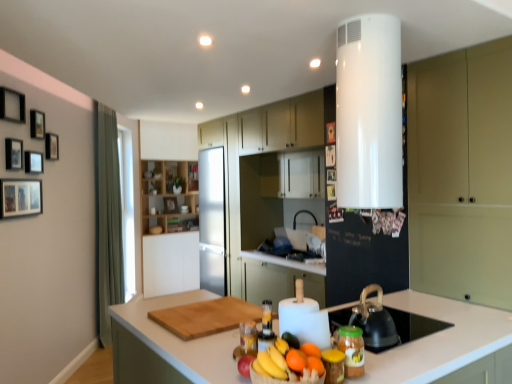
Question: Would you consider black matte tea pot at lower right to be distant from wooden picture frame at upper left, which is counted as the 7th picture frame, starting from the back?

Choices:
 (A) no
 (B) yes

Answer: (B)

Question: Can you confirm if black matte tea pot at lower right is positioned to the right of wooden picture frame at upper left, the 2th picture frame viewed from the left?

Choices:
 (A) yes
 (B) no

Answer: (A)

Question: Is black matte tea pot at lower right turned away from wooden picture frame at upper left, the tenth picture frame in the right-to-left sequence?

Choices:
 (A) no
 (B) yes

Answer: (A)

Question: Considering the relative sizes of black matte tea pot at lower right and wooden picture frame at upper left, the 2th picture frame viewed from the left, in the image provided, is black matte tea pot at lower right thinner than wooden picture frame at upper left, the 2th picture frame viewed from the left,?

Choices:
 (A) no
 (B) yes

Answer: (A)

Question: Is black matte tea pot at lower right in contact with wooden picture frame at upper left, the 2th picture frame viewed from the left?

Choices:
 (A) no
 (B) yes

Answer: (A)

Question: Considering the relative positions of black matte tea pot at lower right and wooden picture frame at upper left, which is the fifth picture frame in front-to-back order, in the image provided, is black matte tea pot at lower right to the left of wooden picture frame at upper left, which is the fifth picture frame in front-to-back order, from the viewer's perspective?

Choices:
 (A) yes
 (B) no

Answer: (B)

Question: Are wooden picture frame at upper center, which ranks as the 9th picture frame in left-to-right order, and black matte tea pot at lower right far apart?

Choices:
 (A) no
 (B) yes

Answer: (B)

Question: Considering the relative sizes of wooden picture frame at upper center, placed as the 3th picture frame when sorted from right to left, and black matte tea pot at lower right in the image provided, is wooden picture frame at upper center, placed as the 3th picture frame when sorted from right to left, wider than black matte tea pot at lower right?

Choices:
 (A) no
 (B) yes

Answer: (A)

Question: Is the depth of wooden picture frame at upper center, placed as the 3th picture frame when sorted from right to left, less than that of black matte tea pot at lower right?

Choices:
 (A) no
 (B) yes

Answer: (A)

Question: Is wooden picture frame at upper center, which is counted as the sixth picture frame, starting from the front, not within black matte tea pot at lower right?

Choices:
 (A) no
 (B) yes

Answer: (B)

Question: Could you tell me if wooden picture frame at upper center, placed as the 3th picture frame when sorted from right to left, is facing black matte tea pot at lower right?

Choices:
 (A) no
 (B) yes

Answer: (A)

Question: Considering the relative sizes of wooden picture frame at upper center, which is counted as the sixth picture frame, starting from the front, and black matte tea pot at lower right in the image provided, is wooden picture frame at upper center, which is counted as the sixth picture frame, starting from the front, bigger than black matte tea pot at lower right?

Choices:
 (A) no
 (B) yes

Answer: (A)

Question: Considering the relative sizes of wooden picture frame at upper center, marked as the fifth picture frame in a back-to-front arrangement, and wooden picture frame at upper center, arranged as the tenth picture frame when viewed from the left, in the image provided, is wooden picture frame at upper center, marked as the fifth picture frame in a back-to-front arrangement, bigger than wooden picture frame at upper center, arranged as the tenth picture frame when viewed from the left,?

Choices:
 (A) no
 (B) yes

Answer: (B)